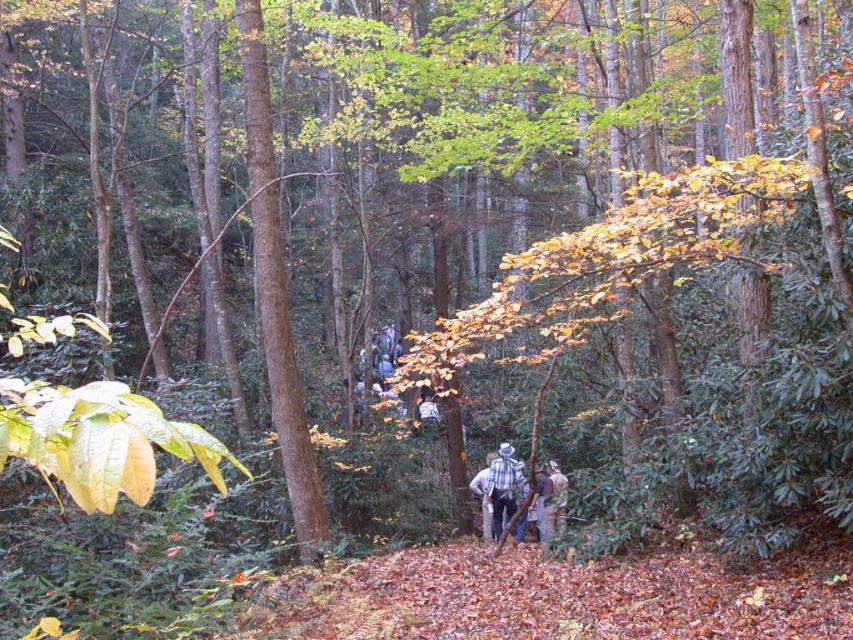
Can you confirm if plaid shirt at center is bigger than plaid flannel shirt at center?

Indeed, plaid shirt at center has a larger size compared to plaid flannel shirt at center.

Is plaid shirt at center further to camera compared to plaid flannel shirt at center?

No, it is in front of plaid flannel shirt at center.

Where is `plaid shirt at center`? This screenshot has height=640, width=853. plaid shirt at center is located at coordinates (511, 490).